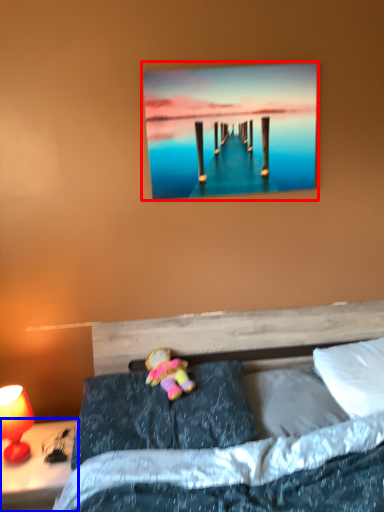
Question: Which object appears farthest to the camera in this image, picture frame (highlighted by a red box) or nightstand (highlighted by a blue box)?

Choices:
 (A) picture frame
 (B) nightstand

Answer: (A)